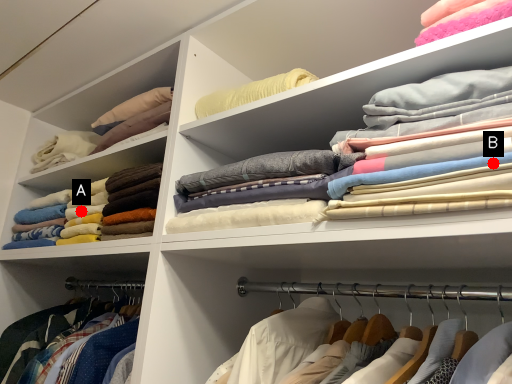
Question: Two points are circled on the image, labeled by A and B beside each circle. Which point is closer to the camera?

Choices:
 (A) A is closer
 (B) B is closer

Answer: (B)